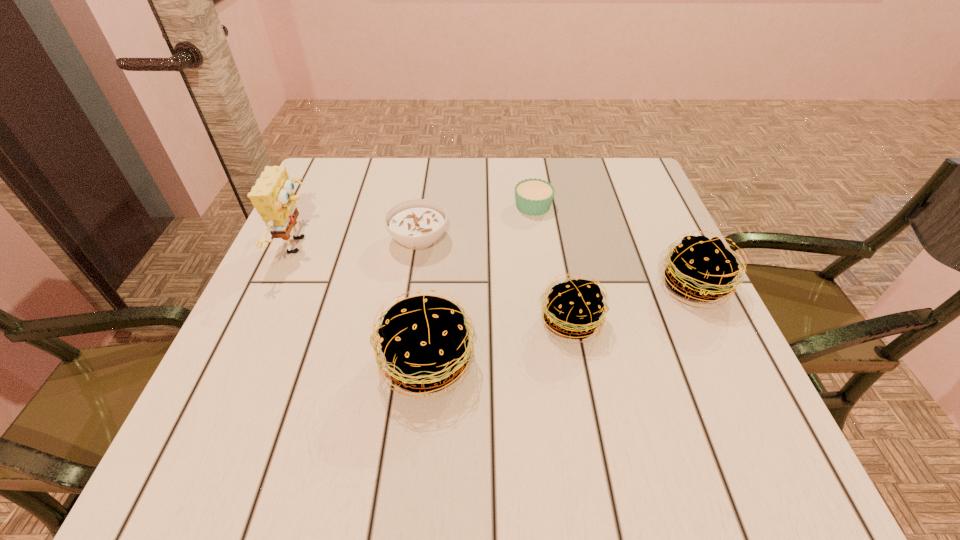
The width and height of the screenshot is (960, 540). I want to click on vacant area at the near edge, so click(626, 386).

Locate an element on the screen. free point at the left edge is located at coordinates click(294, 310).

This screenshot has width=960, height=540. Find the location of `vacant space at the right edge of the desktop`. vacant space at the right edge of the desktop is located at coordinates (725, 341).

Identify the location of vacant space at the far left corner. (305, 195).

Identify the location of blank space at the far right corner of the desktop. The width and height of the screenshot is (960, 540). (592, 173).

In order to click on unoccupied area between the leftmost patty and the leftmost object in this screenshot , I will do (363, 304).

This screenshot has width=960, height=540. What are the coordinates of `vacant region between the rightmost patty and the shortest object` in the screenshot? It's located at (613, 246).

The height and width of the screenshot is (540, 960). Identify the location of free space that is in between the fourth tallest object and the leftmost patty. (499, 342).

This screenshot has height=540, width=960. In order to click on vacant point located between the shortest object and the shortest patty in this screenshot , I will do `click(552, 264)`.

You are a GUI agent. You are given a task and a screenshot of the screen. Output one action in this format:
    pyautogui.click(x=<x>, y=<y>)
    Task: Click on the vacant region between the soup bowl and the shortest object
    This screenshot has width=960, height=540.
    Given the screenshot: What is the action you would take?
    pyautogui.click(x=476, y=222)